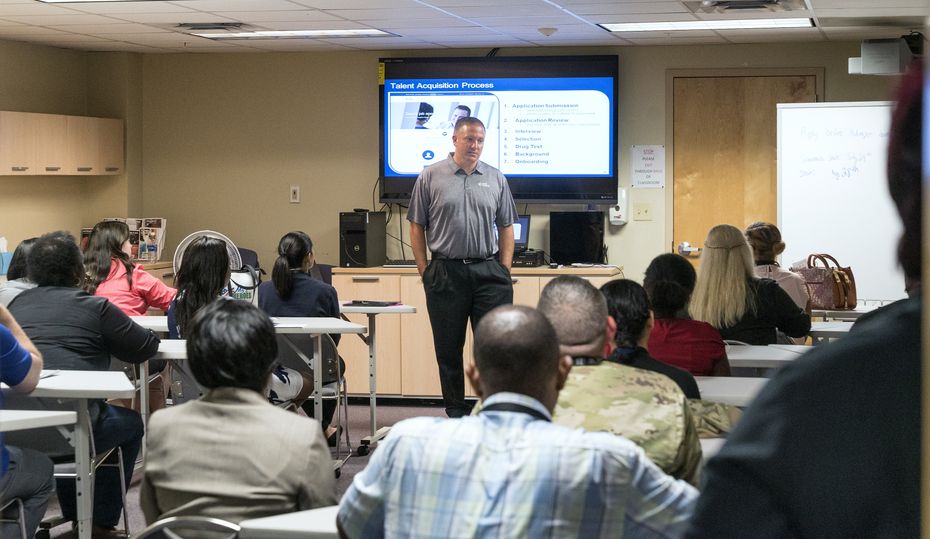
Image resolution: width=930 pixels, height=539 pixels. Find the location of `door handle`. door handle is located at coordinates (682, 248).